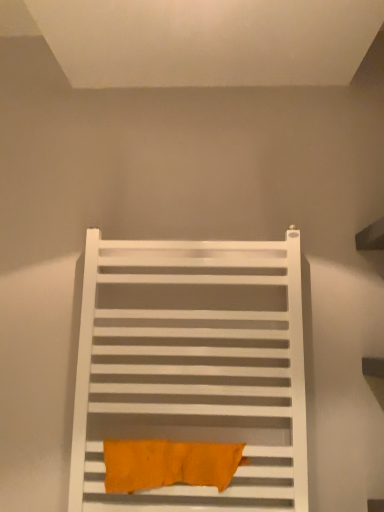
Question: From a real-world perspective, is white matte towel rack at center over orange fabric towel at center?

Choices:
 (A) yes
 (B) no

Answer: (A)

Question: Is white matte towel rack at center positioned before orange fabric towel at center?

Choices:
 (A) yes
 (B) no

Answer: (A)

Question: From the image's perspective, is white matte towel rack at center under orange fabric towel at center?

Choices:
 (A) no
 (B) yes

Answer: (A)

Question: Is orange fabric towel at center a part of white matte towel rack at center?

Choices:
 (A) yes
 (B) no

Answer: (A)

Question: Can you confirm if white matte towel rack at center is smaller than orange fabric towel at center?

Choices:
 (A) no
 (B) yes

Answer: (A)

Question: Is white matte towel rack at center at the right side of orange fabric towel at center?

Choices:
 (A) yes
 (B) no

Answer: (B)

Question: From a real-world perspective, is orange fabric towel at center over white matte towel rack at center?

Choices:
 (A) no
 (B) yes

Answer: (A)

Question: Is orange fabric towel at center at the left side of white matte towel rack at center?

Choices:
 (A) no
 (B) yes

Answer: (A)

Question: From a real-world perspective, is orange fabric towel at center below white matte towel rack at center?

Choices:
 (A) no
 (B) yes

Answer: (B)

Question: Considering the relative sizes of orange fabric towel at center and white matte towel rack at center in the image provided, is orange fabric towel at center shorter than white matte towel rack at center?

Choices:
 (A) no
 (B) yes

Answer: (B)

Question: Is orange fabric towel at center to the right of white matte towel rack at center from the viewer's perspective?

Choices:
 (A) yes
 (B) no

Answer: (A)

Question: Is the position of orange fabric towel at center less distant than that of white matte towel rack at center?

Choices:
 (A) no
 (B) yes

Answer: (A)

Question: Is orange fabric towel at center taller or shorter than white matte towel rack at center?

Choices:
 (A) tall
 (B) short

Answer: (B)